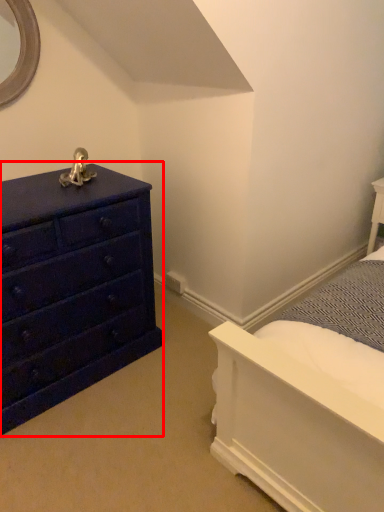
Question: From the image's perspective, considering the relative positions of chest of drawers (annotated by the red box) and bedding in the image provided, where is chest of drawers (annotated by the red box) located with respect to the staircase?

Choices:
 (A) above
 (B) below

Answer: (A)